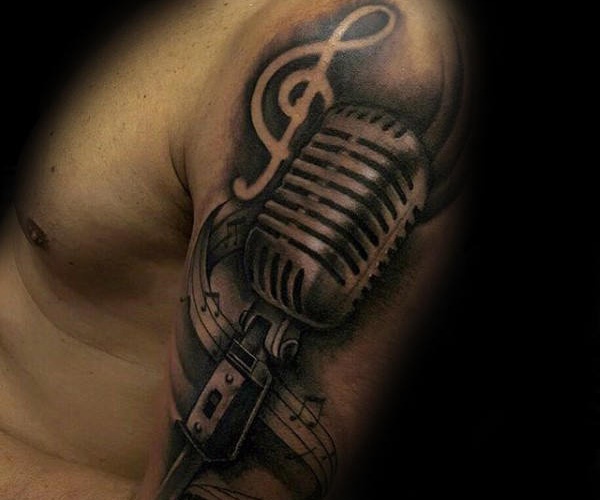
The height and width of the screenshot is (500, 600). What are the coordinates of `power switch` in the screenshot? It's located at (211, 406).